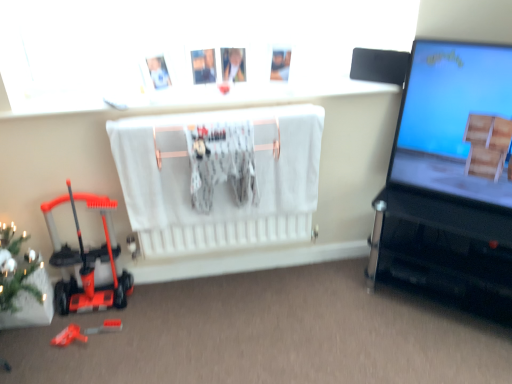
Question: Considering the relative positions of rubberized orange toy at lower left, the first toy from the bottom, and green matte christmas tree at lower left in the image provided, is rubberized orange toy at lower left, the first toy from the bottom, to the left of green matte christmas tree at lower left from the viewer's perspective?

Choices:
 (A) yes
 (B) no

Answer: (B)

Question: Is rubberized orange toy at lower left, arranged as the 3th toy when viewed from the top, positioned beyond the bounds of green matte christmas tree at lower left?

Choices:
 (A) yes
 (B) no

Answer: (A)

Question: Is rubberized orange toy at lower left, arranged as the 3th toy when viewed from the top, oriented towards green matte christmas tree at lower left?

Choices:
 (A) yes
 (B) no

Answer: (B)

Question: From the image's perspective, is rubberized orange toy at lower left, arranged as the 3th toy when viewed from the top, located beneath green matte christmas tree at lower left?

Choices:
 (A) no
 (B) yes

Answer: (B)

Question: Does rubberized orange toy at lower left, arranged as the 3th toy when viewed from the top, come in front of green matte christmas tree at lower left?

Choices:
 (A) yes
 (B) no

Answer: (B)

Question: Is rubberized orange toy at lower left, arranged as the 3th toy when viewed from the top, facing away from green matte christmas tree at lower left?

Choices:
 (A) yes
 (B) no

Answer: (B)

Question: Is the position of rubberized orange toy at lower left, which is counted as the second toy, starting from the bottom, less distant than that of orange plastic toy at lower left, the 1th toy when ordered from top to bottom?

Choices:
 (A) yes
 (B) no

Answer: (B)

Question: Is rubberized orange toy at lower left, which is counted as the 2th toy, starting from the top, positioned with its back to orange plastic toy at lower left, the 1th toy when ordered from top to bottom?

Choices:
 (A) no
 (B) yes

Answer: (B)

Question: Is rubberized orange toy at lower left, which is counted as the second toy, starting from the bottom, placed right next to orange plastic toy at lower left, the 1th toy when ordered from top to bottom?

Choices:
 (A) yes
 (B) no

Answer: (B)

Question: Considering the relative positions of rubberized orange toy at lower left, which is counted as the 2th toy, starting from the top, and orange plastic toy at lower left, the 1th toy when ordered from top to bottom, in the image provided, is rubberized orange toy at lower left, which is counted as the 2th toy, starting from the top, to the left of orange plastic toy at lower left, the 1th toy when ordered from top to bottom, from the viewer's perspective?

Choices:
 (A) yes
 (B) no

Answer: (B)

Question: Is rubberized orange toy at lower left, which is counted as the second toy, starting from the bottom, shorter than orange plastic toy at lower left, positioned as the 3th toy in bottom-to-top order?

Choices:
 (A) no
 (B) yes

Answer: (B)

Question: Does rubberized orange toy at lower left, which is counted as the 2th toy, starting from the top, contain orange plastic toy at lower left, the 1th toy when ordered from top to bottom?

Choices:
 (A) yes
 (B) no

Answer: (B)

Question: Does orange plastic toy at lower left, the 1th toy when ordered from top to bottom, have a lesser width compared to rubberized orange toy at lower left, which is counted as the 2th toy, starting from the top?

Choices:
 (A) yes
 (B) no

Answer: (B)